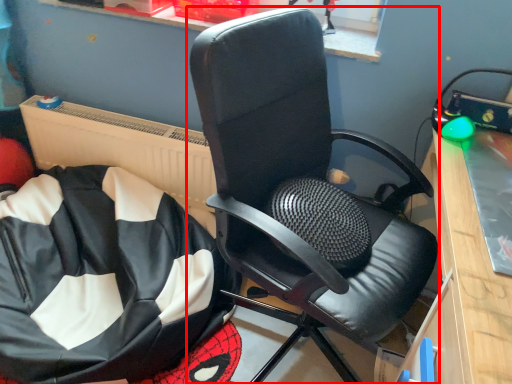
Question: From the image, what is the correct spatial relationship of chair (annotated by the red box) in relation to bean bag chair?

Choices:
 (A) left
 (B) right

Answer: (B)